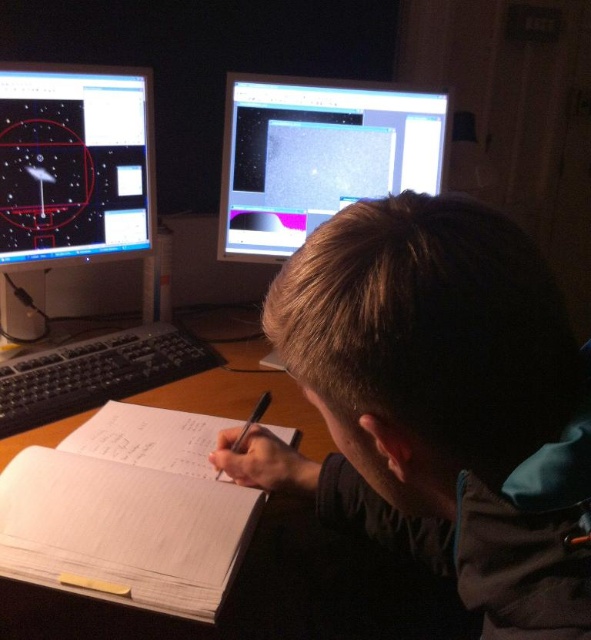
Between brown hair at center and black plastic keyboard at center, which one is positioned higher?

black plastic keyboard at center is higher up.

Consider the image. Is brown hair at center taller than black plastic keyboard at center?

Yes, brown hair at center is taller than black plastic keyboard at center.

Is point (459, 330) positioned before point (86, 344)?

Yes, point (459, 330) is in front of point (86, 344).

What are the coordinates of `brown hair at center` in the screenshot? It's located at (440, 403).

This screenshot has height=640, width=591. Describe the element at coordinates (317, 156) in the screenshot. I see `matte black monitor at upper center` at that location.

Between point (291, 147) and point (85, 586), which one is positioned behind?

Positioned behind is point (291, 147).

Which is behind, point (433, 92) or point (118, 589)?

Point (433, 92)

I want to click on matte black monitor at upper center, so click(x=317, y=156).

Which of these two, matte black monitor at upper left or white paper at center, stands shorter?

white paper at center is shorter.

Does matte black monitor at upper left have a smaller size compared to white paper at center?

No, matte black monitor at upper left is not smaller than white paper at center.

The height and width of the screenshot is (640, 591). Describe the element at coordinates (73, 163) in the screenshot. I see `matte black monitor at upper left` at that location.

At what (x,y) coordinates should I click in order to perform the action: click on matte black monitor at upper left. Please return your answer as a coordinate pair (x, y). This screenshot has height=640, width=591. Looking at the image, I should click on (73, 163).